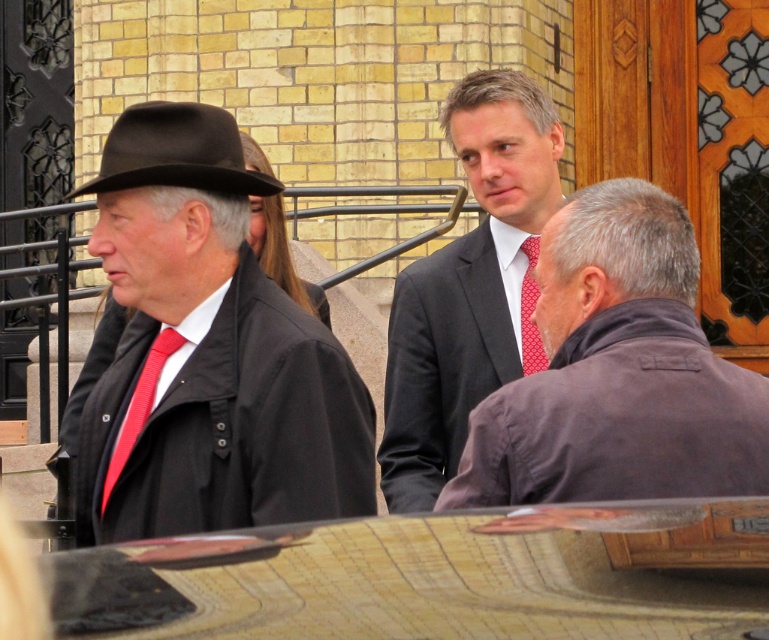
You are a photographer setting up for an event. You need to position a light source to illuminate both the dark gray suit at center and the red textured tie at left. Based on their positions, where should you place the light source relative to the photographer?

The dark gray suit at center is located above the red textured tie at left, so placing the light source above and slightly to the right of the photographer would effectively illuminate both objects.